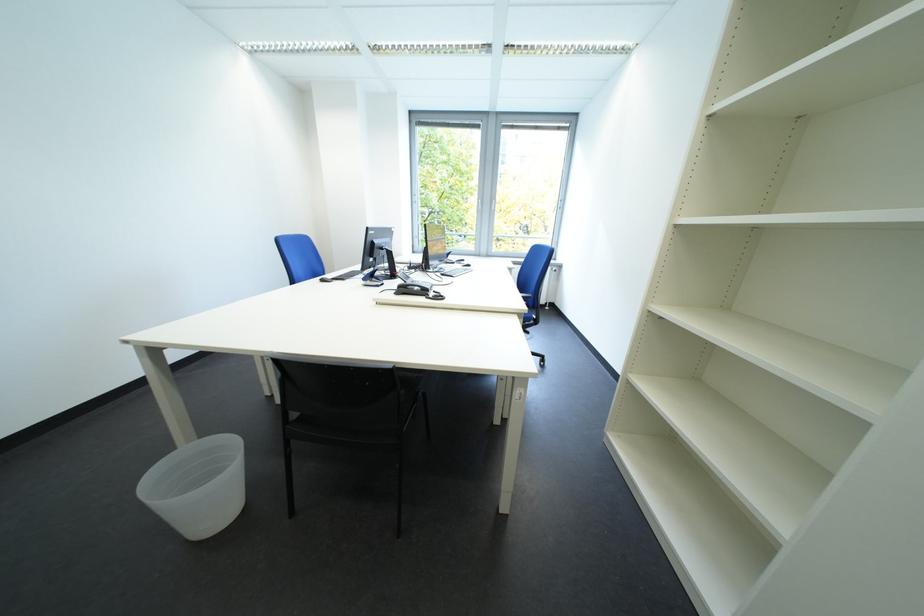
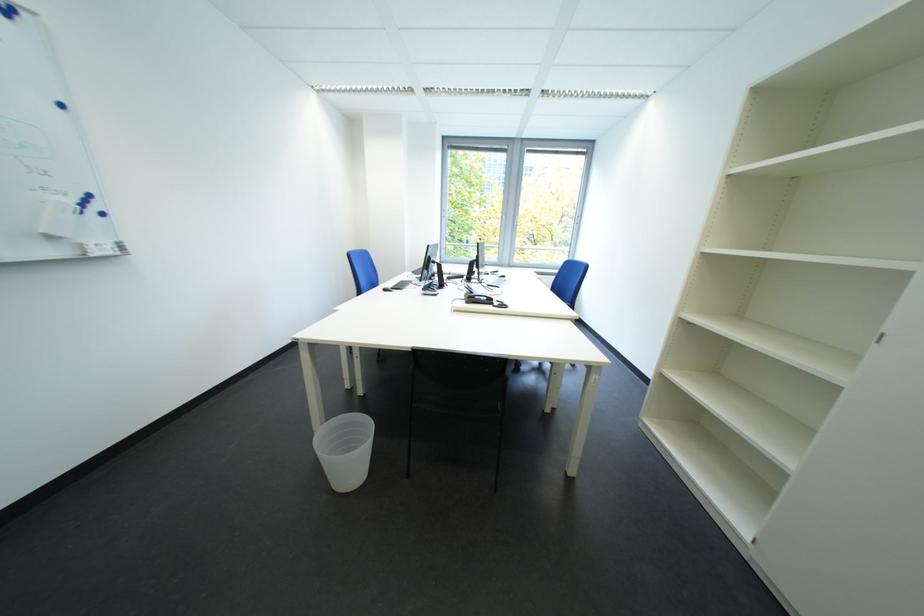
Find the pixel in the second image that matches point 327,278 in the first image.

(385, 286)